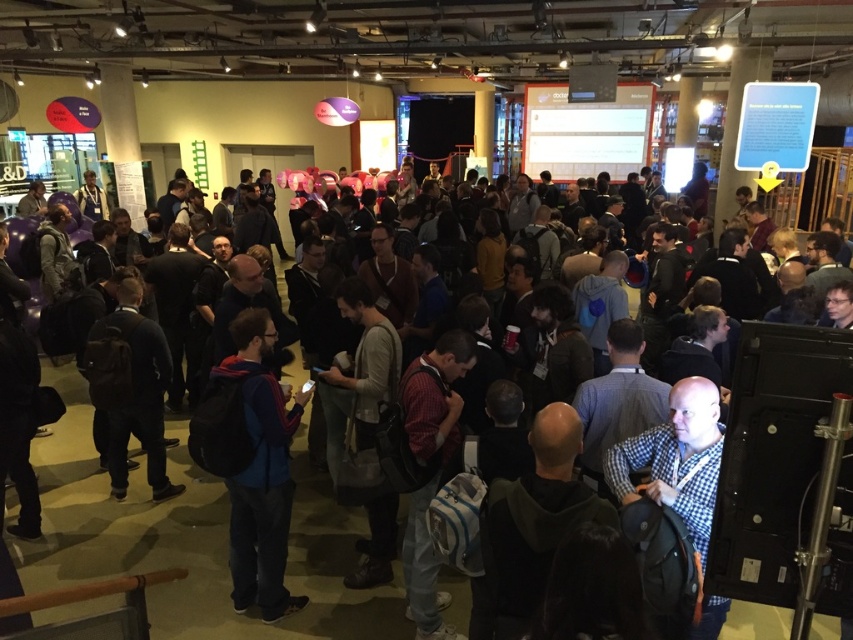
Question: Considering the real-world distances, which object is farthest from the blue fleece jacket at center?

Choices:
 (A) dark blue backpack at center
 (B) checkered fabric shirt at center

Answer: (B)

Question: Which object is farther from the camera taking this photo?

Choices:
 (A) checkered fabric shirt at center
 (B) blue fleece jacket at center

Answer: (B)

Question: Is blue fleece jacket at center further to camera compared to checkered fabric shirt at center?

Choices:
 (A) no
 (B) yes

Answer: (B)

Question: Is blue fleece jacket at center to the right of checkered fabric shirt at center from the viewer's perspective?

Choices:
 (A) yes
 (B) no

Answer: (B)

Question: Based on their relative distances, which object is farther from the dark blue backpack at center?

Choices:
 (A) blue fleece jacket at center
 (B) checkered fabric shirt at center

Answer: (B)

Question: Is blue fleece jacket at center further to the viewer compared to checkered fabric shirt at center?

Choices:
 (A) no
 (B) yes

Answer: (B)